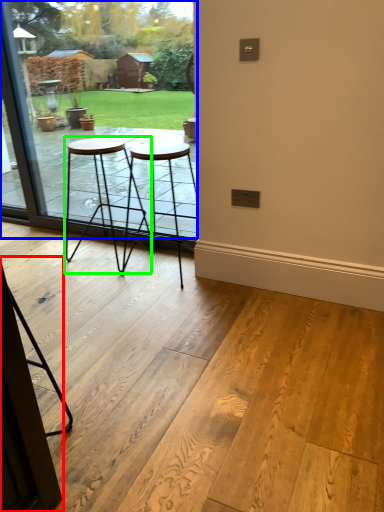
Question: Based on their relative distances, which object is nearer to screen door (highlighted by a red box)? Choose from window (highlighted by a blue box) and stool (highlighted by a green box).

Choices:
 (A) window
 (B) stool

Answer: (B)